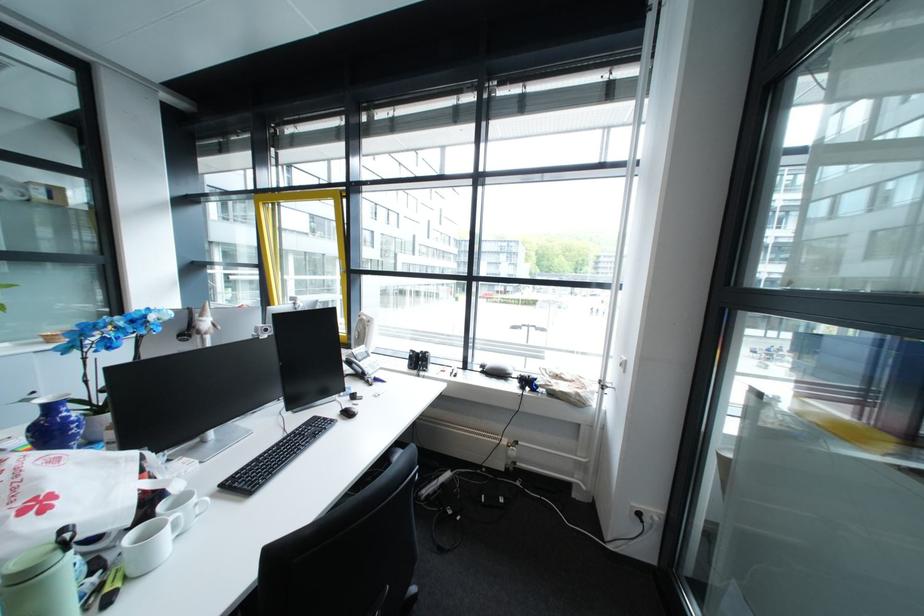
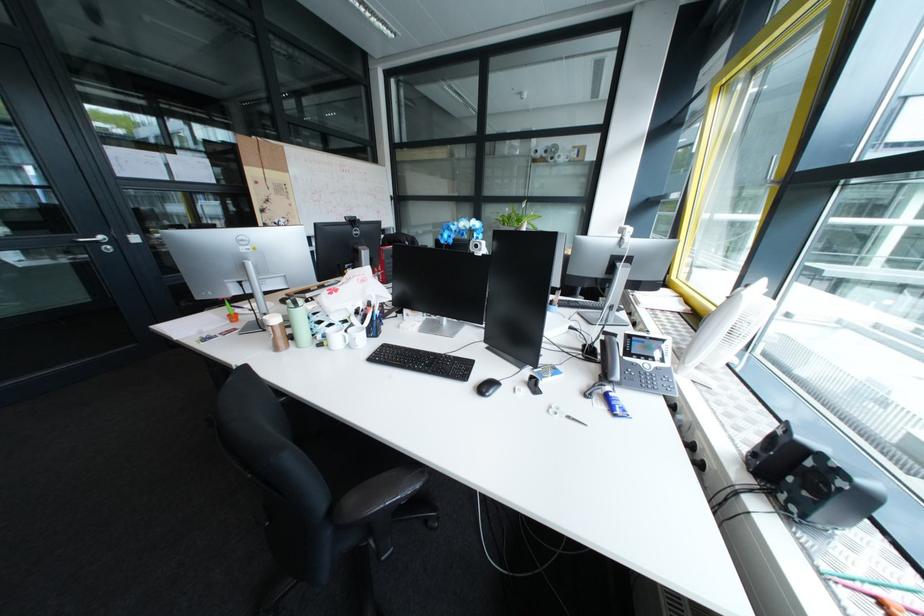
In the second image, find the point that corresponds to the point at 388,398 in the first image.

(560, 408)